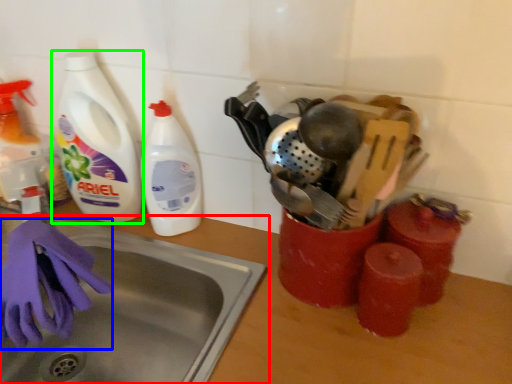
Question: Based on their relative distances, which object is farther from sink (highlighted by a red box)? Choose from glove (highlighted by a blue box) and bottle (highlighted by a green box).

Choices:
 (A) glove
 (B) bottle

Answer: (B)